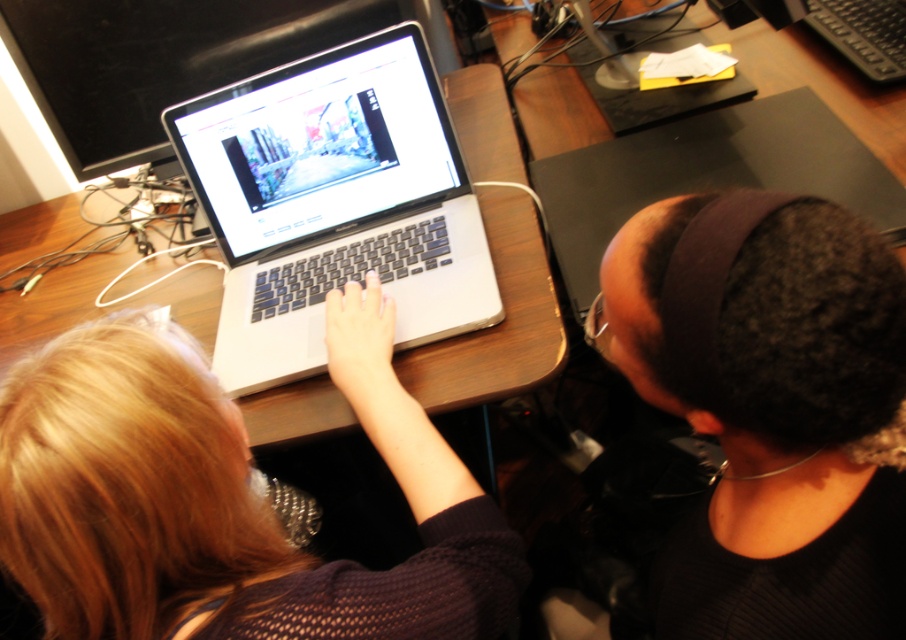
You are organizing a small event and need to place a 1.5 square feet decorative plate on the wooden table at center. Considering the size of the sleek silver laptop at center already on it, will there be enough space?

The wooden table at center is bigger than the sleek silver laptop at center, so there should be enough space to place the 1.5 square feet decorative plate alongside the laptop.

You are setting up a new monitor that requires the surface to be at least 75 cm tall. Given the wooden table at center and the sleek silver laptop at center, which object can support the monitor?

The wooden table at center has a greater height compared to the sleek silver laptop at center, so the wooden table at center can support the monitor.